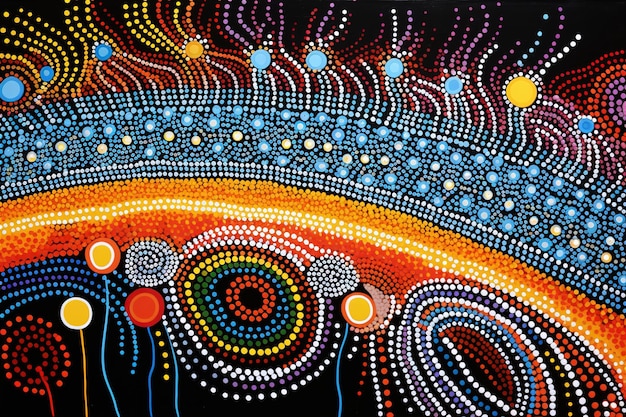
The image size is (626, 417). What are the coordinates of `lights` in the screenshot? It's located at (404, 244).